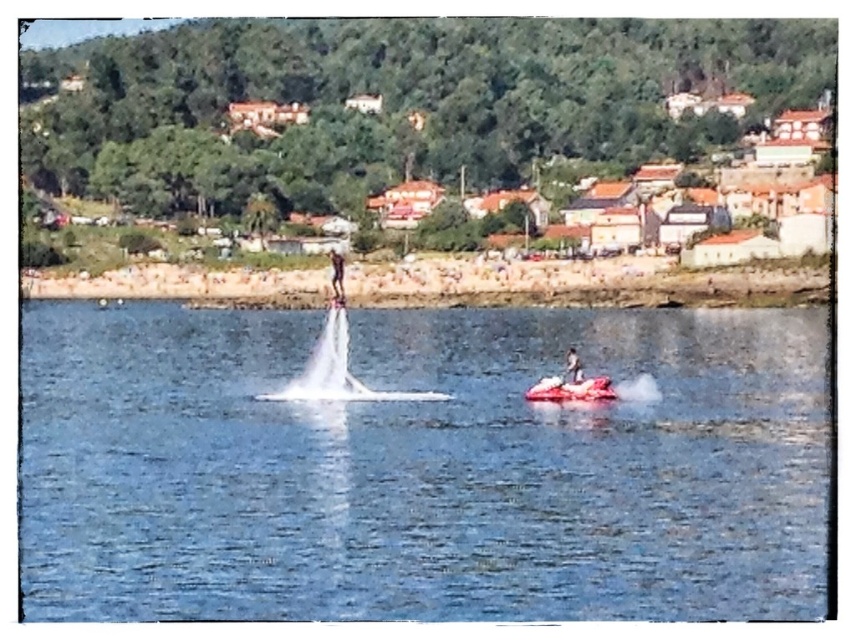
Who is more forward, (336, 278) or (569, 368)?

Point (336, 278) is more forward.

Does smooth skin person at upper center have a greater height compared to smooth white surfboard at center?

Yes.

This screenshot has width=856, height=640. Find the location of `smooth skin person at upper center`. smooth skin person at upper center is located at coordinates (337, 275).

Identify the location of smooth skin person at upper center. The width and height of the screenshot is (856, 640). (337, 275).

Is point (817, 497) in front of point (577, 364)?

That is True.

Which is in front, point (301, 502) or point (581, 372)?

Point (301, 502)

This screenshot has height=640, width=856. In order to click on clear blue water at center in this screenshot , I will do `click(421, 467)`.

Can you confirm if red rubber boat at center is positioned below smooth skin person at upper center?

Yes.

Does red rubber boat at center appear on the right side of smooth skin person at upper center?

Indeed, red rubber boat at center is positioned on the right side of smooth skin person at upper center.

Image resolution: width=856 pixels, height=640 pixels. Identify the location of red rubber boat at center. (569, 388).